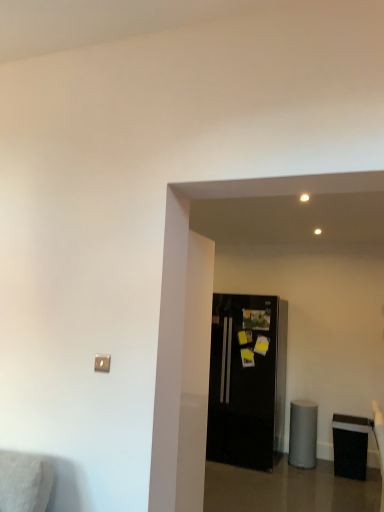
Question: Is black matte trash can at lower right wider or thinner than black glossy refrigerator at center?

Choices:
 (A) thin
 (B) wide

Answer: (A)

Question: Does point (337, 422) appear closer or farther from the camera than point (281, 431)?

Choices:
 (A) farther
 (B) closer

Answer: (B)

Question: Visually, is black matte trash can at lower right positioned to the left or to the right of black glossy refrigerator at center?

Choices:
 (A) right
 (B) left

Answer: (A)

Question: Would you say black glossy refrigerator at center is inside or outside black matte trash can at lower right?

Choices:
 (A) outside
 (B) inside

Answer: (A)

Question: Based on their sizes in the image, would you say black glossy refrigerator at center is bigger or smaller than black matte trash can at lower right?

Choices:
 (A) small
 (B) big

Answer: (B)

Question: Relative to black matte trash can at lower right, is black glossy refrigerator at center in front or behind?

Choices:
 (A) behind
 (B) front

Answer: (A)

Question: From a real-world perspective, is black glossy refrigerator at center physically located above or below black matte trash can at lower right?

Choices:
 (A) below
 (B) above

Answer: (B)